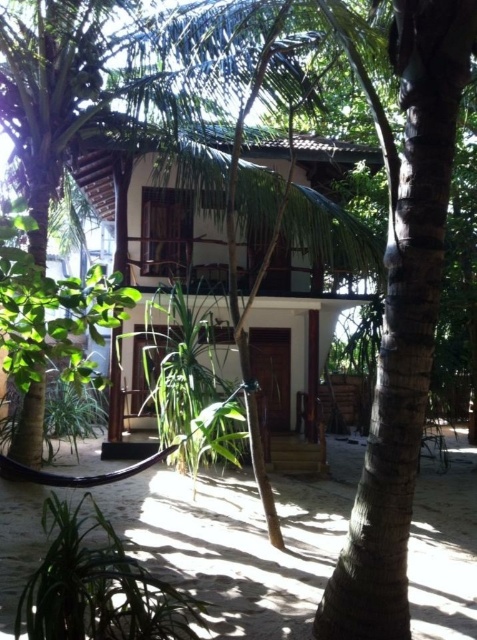
Question: Can you confirm if white wood house at center is thinner than green leafy plant at lower left?

Choices:
 (A) yes
 (B) no

Answer: (B)

Question: Which point is closer to the camera?

Choices:
 (A) (142, 618)
 (B) (257, 262)

Answer: (A)

Question: Does white wood house at center appear on the right side of green leafy plant at lower left?

Choices:
 (A) no
 (B) yes

Answer: (B)

Question: Which of the following is the closest to the observer?

Choices:
 (A) white wood house at center
 (B) green leafy plant at lower left

Answer: (B)

Question: Does white wood house at center lie in front of green leafy plant at lower left?

Choices:
 (A) no
 (B) yes

Answer: (A)